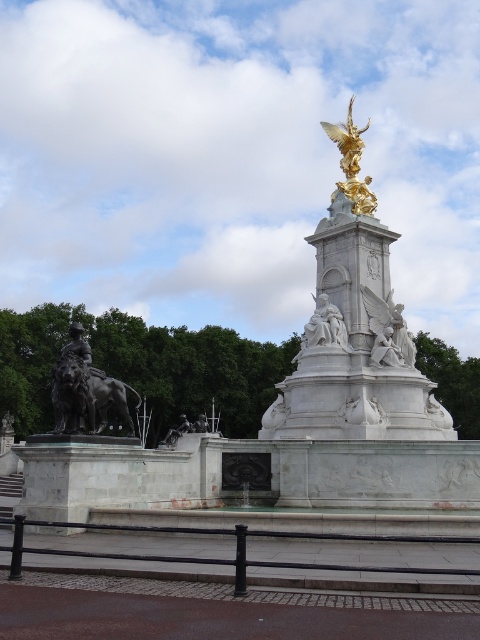
Question: Observing the image, what is the correct spatial positioning of white marble angel at lower right in reference to gold metallic angel at upper center?

Choices:
 (A) left
 (B) right

Answer: (A)

Question: Does gold polished statue at center have a smaller size compared to white marble angel at lower right?

Choices:
 (A) yes
 (B) no

Answer: (B)

Question: Can you confirm if bronze statue at left is positioned below white marble angel at lower right?

Choices:
 (A) yes
 (B) no

Answer: (A)

Question: Which object is positioned farthest from the gold metallic angel at upper center?

Choices:
 (A) gold polished statue at center
 (B) bronze statue at left
 (C) white marble angel at lower right

Answer: (B)

Question: Estimate the real-world distances between objects in this image. Which object is farther from the bronze statue at left?

Choices:
 (A) gold metallic angel at upper center
 (B) gold polished statue at center

Answer: (A)

Question: Among these objects, which one is farthest from the camera?

Choices:
 (A) white marble angel at lower right
 (B) bronze statue at left

Answer: (A)